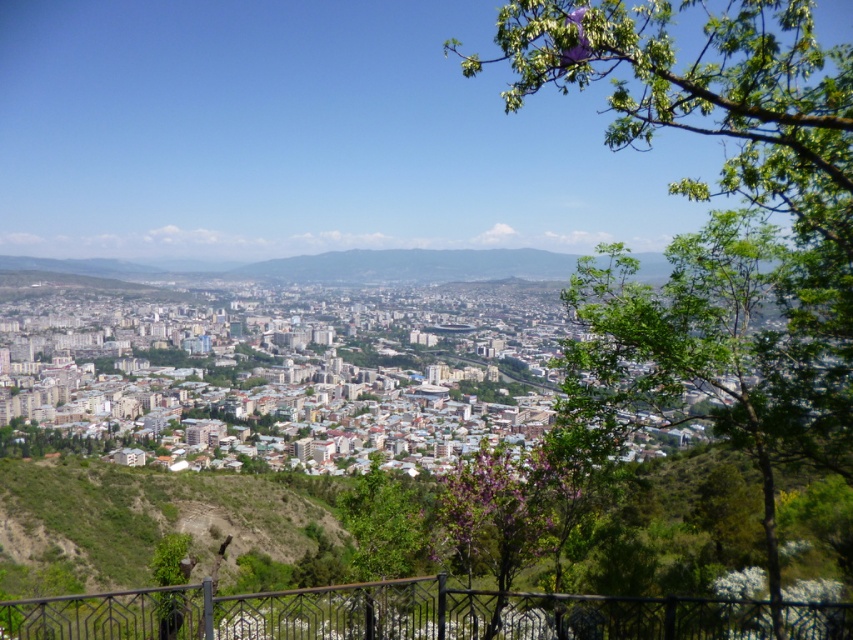
You are standing on a viewing platform overlooking the city. You notice the black metal railing at lower center and the green leafy tree at lower left. Which object is positioned closer to the edge of the platform?

The black metal railing at lower center is positioned closer to the edge of the platform since it is located below the green leafy tree at lower left, indicating it is further down towards the edge.

You are standing at the metal railing at the bottom edge of the frame. Looking at the green leafy tree at center and the green leafy tree at lower left, which one appears closer to you?

The green leafy tree at lower left appears closer because it is positioned below the green leafy tree at center, which is above it.